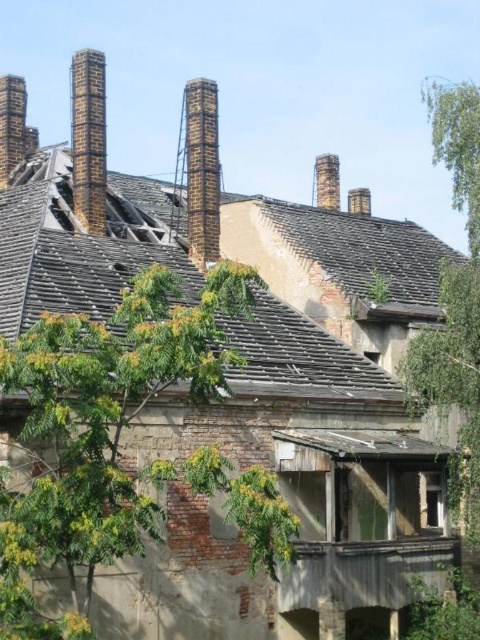
From the picture: You are standing in front of the old building and want to locate the weathered wood roof at upper center. Where exactly is it positioned in the image?

The weathered wood roof at upper center is positioned at point 0.455 on the x axis and 0.692 on the y axis.